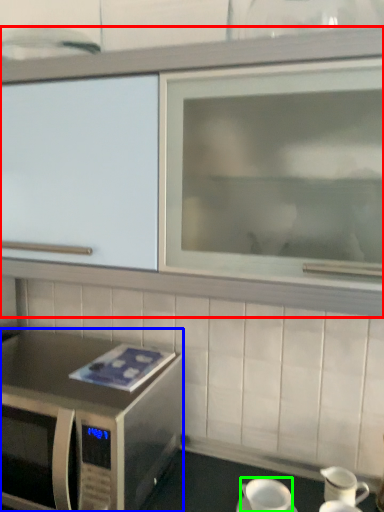
Question: Which object is positioned farthest from cabinetry (highlighted by a red box)? Select from microwave oven (highlighted by a blue box) and coffee cup (highlighted by a green box).

Choices:
 (A) microwave oven
 (B) coffee cup

Answer: (B)